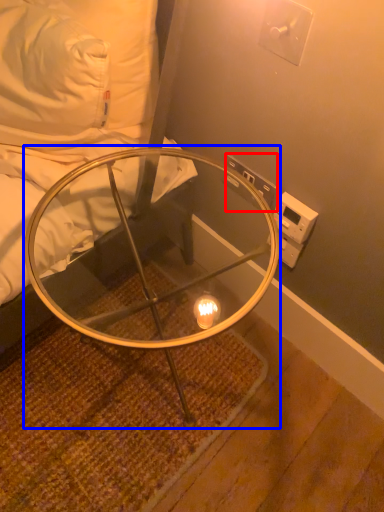
Question: Which object is further to the camera taking this photo, electric outlet (highlighted by a red box) or table (highlighted by a blue box)?

Choices:
 (A) electric outlet
 (B) table

Answer: (A)